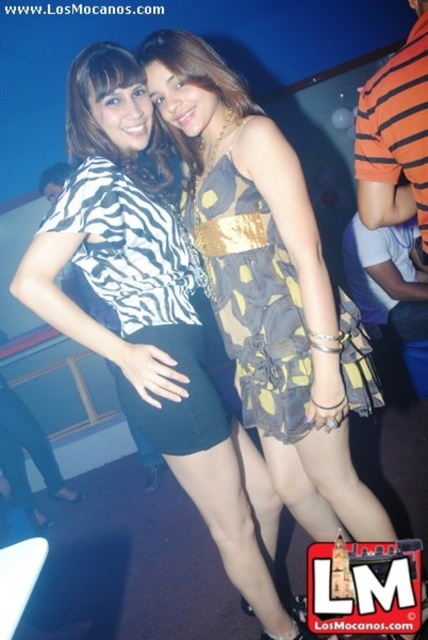
You are a photographer trying to adjust the lighting for a portrait. You notice the zebra print blouse at center and the printed fabric dress at center. Which clothing item is positioned lower in the image?

The zebra print blouse at center is below the printed fabric dress at center, so the zebra print blouse at center is positioned lower in the image.